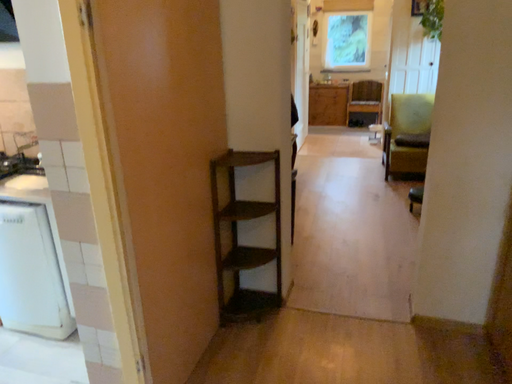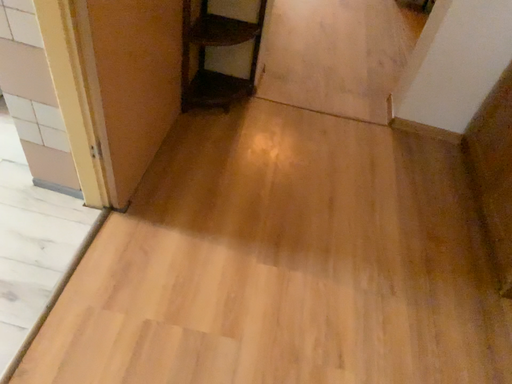
Question: Which way did the camera rotate in the video?

Choices:
 (A) rotated upward
 (B) rotated downward

Answer: (B)